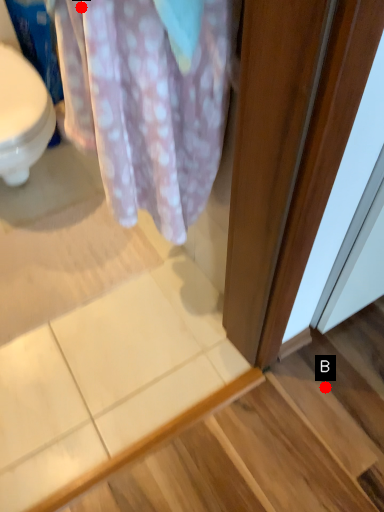
Question: Two points are circled on the image, labeled by A and B beside each circle. Among these points, which one is farthest from the camera?

Choices:
 (A) A is further
 (B) B is further

Answer: (B)